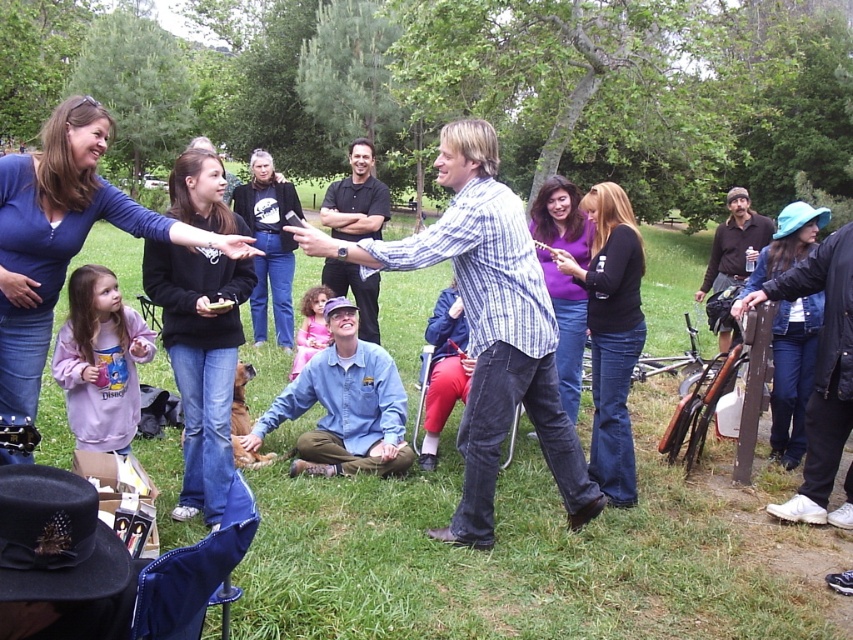
Question: Which point is closer to the camera?

Choices:
 (A) blue denim shirt at center
 (B) black denim jeans at center

Answer: (B)

Question: From the image, what is the correct spatial relationship of matte blue shirt at upper left in relation to purple matte shirt at center?

Choices:
 (A) left
 (B) right

Answer: (A)

Question: Which object appears closest to the camera in this image?

Choices:
 (A) black shirt at center
 (B) matte blue shirt at upper left

Answer: (B)

Question: Which point is farther from the camera taking this photo?

Choices:
 (A) (355, 374)
 (B) (519, 211)

Answer: (A)

Question: Can you confirm if blue denim jeans at lower right is positioned to the left of purple matte shirt at center?

Choices:
 (A) yes
 (B) no

Answer: (B)

Question: Is purple matte shirt at center above brown leather jacket at right?

Choices:
 (A) yes
 (B) no

Answer: (B)